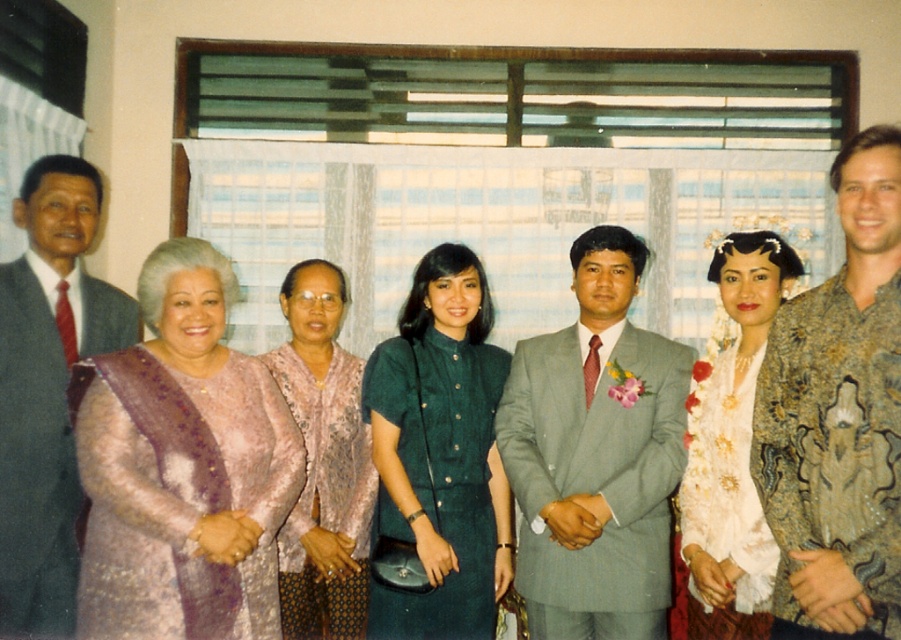
You are standing in the room and want to move from point A to point B. Point A is at coordinates point(x=535, y=346) and point B is at point(x=310, y=260). Can you walk directly from point A to point B without any obstacles?

Since point(x=535, y=346) is in front of point(x=310, y=260), you can walk directly from point A to point B without any obstacles.